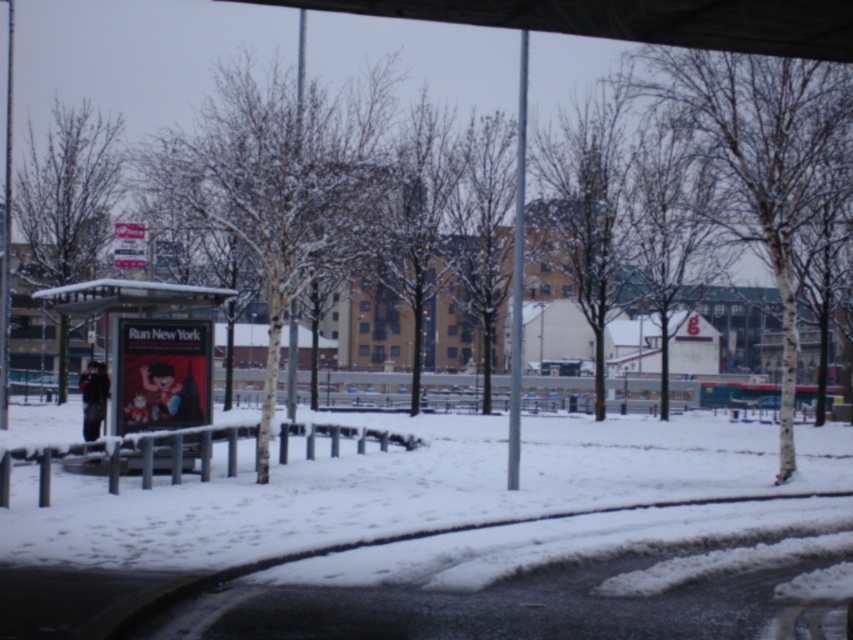
Does white powdery snow at lower center have a greater width compared to white plastic bus stop at left?

Yes.

Is the position of white powdery snow at lower center more distant than that of white plastic bus stop at left?

No.

Is point (341, 582) in front of point (125, 284)?

That is True.

Where is `white powdery snow at lower center`? This screenshot has height=640, width=853. white powdery snow at lower center is located at coordinates (318, 509).

Who is more distant from viewer, (432,538) or (782,36)?

Point (432,538)

Does white powdery snow at lower center have a lesser width compared to black tarp at upper center?

No.

Which is in front, point (10, 516) or point (787, 0)?

Positioned in front is point (787, 0).

In order to click on white powdery snow at lower center in this screenshot , I will do `click(318, 509)`.

Does black tarp at upper center have a larger size compared to white plastic bus stop at left?

Incorrect, black tarp at upper center is not larger than white plastic bus stop at left.

The height and width of the screenshot is (640, 853). What do you see at coordinates (637, 20) in the screenshot?
I see `black tarp at upper center` at bounding box center [637, 20].

The height and width of the screenshot is (640, 853). Find the location of `black tarp at upper center`. black tarp at upper center is located at coordinates (637, 20).